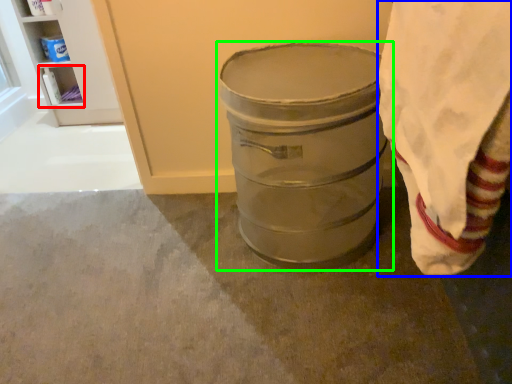
Question: Which is farther away from shelf (highlighted by a red box)? cloth (highlighted by a blue box) or waste container (highlighted by a green box)?

Choices:
 (A) cloth
 (B) waste container

Answer: (A)